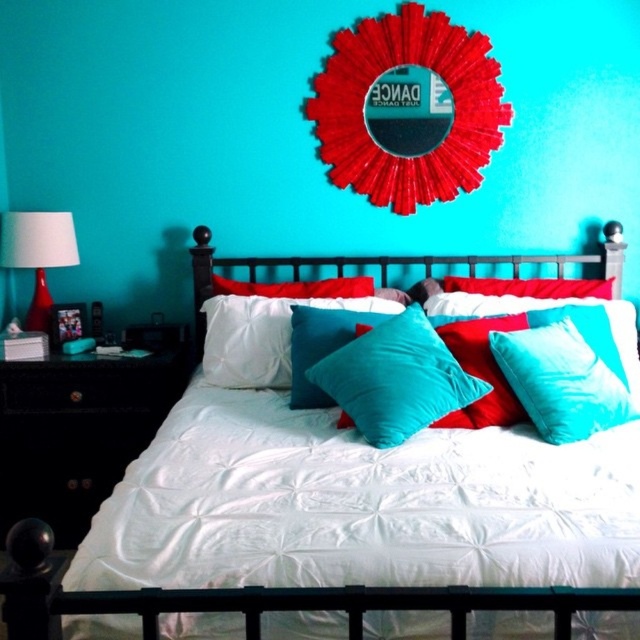
Where is `teal velvet pillows at center`? Image resolution: width=640 pixels, height=640 pixels. teal velvet pillows at center is located at coordinates (234, 602).

Does teal velvet pillows at center have a greater width compared to teal soft cushion at center?

Indeed, teal velvet pillows at center has a greater width compared to teal soft cushion at center.

Does point (220, 596) lie behind point (420, 397)?

No, (220, 596) is closer to viewer.

Find the location of a particular element. teal velvet pillows at center is located at coordinates (234, 602).

Is teal soft cushion at center closer to camera compared to matte red glass lamp at left?

Yes, it is in front of matte red glass lamp at left.

Is point (372, 333) less distant than point (36, 324)?

Yes.

Between point (432, 348) and point (54, 234), which one is positioned behind?

The point (54, 234) is behind.

Where is `teal soft cushion at center`? teal soft cushion at center is located at coordinates (396, 378).

Between point (328, 380) and point (269, 369), which one is positioned in front?

Point (328, 380)

Does point (410, 368) lie behind point (237, 378)?

No, it is not.

Identify the location of teal soft cushion at center. This screenshot has width=640, height=640. (396, 378).